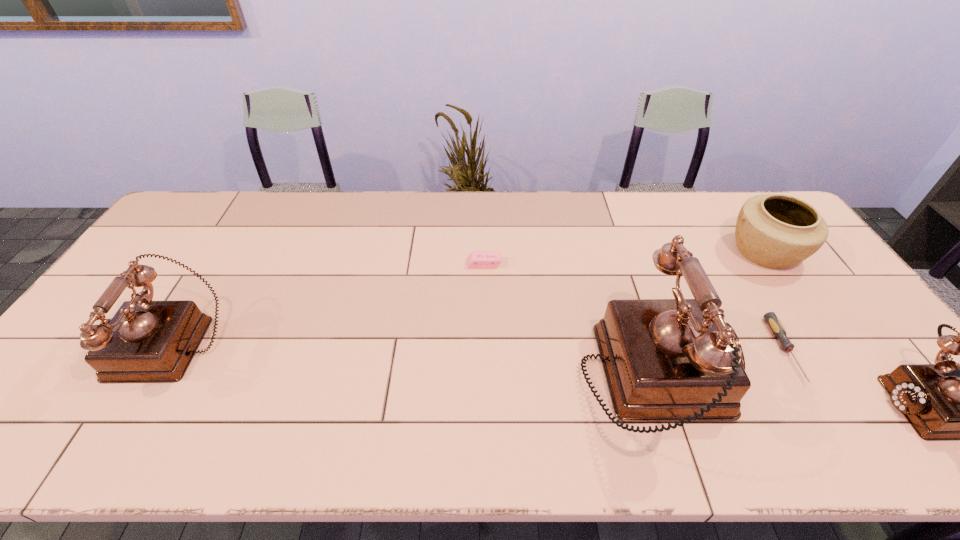
You are a GUI agent. You are given a task and a screenshot of the screen. Output one action in this format:
    pyautogui.click(x=<x>, y=<y>)
    Task: Click on the leftmost telephone
    
    Given the screenshot: What is the action you would take?
    pyautogui.click(x=146, y=341)

Where is `the fifth shortest object`? This screenshot has height=540, width=960. the fifth shortest object is located at coordinates (146, 341).

The width and height of the screenshot is (960, 540). What are the coordinates of `the tallest object` in the screenshot? It's located at (665, 360).

Find the location of a particular element. Image resolution: width=960 pixels, height=540 pixels. the fourth object from right to left is located at coordinates (665, 360).

At what (x,y) coordinates should I click in order to perform the action: click on pottery. Please return your answer as a coordinate pair (x, y). Looking at the image, I should click on (777, 231).

Where is `the fifth object from right to left`? the fifth object from right to left is located at coordinates (477, 259).

Locate an element on the screen. This screenshot has width=960, height=540. screwdriver is located at coordinates (771, 319).

Locate an element on the screen. This screenshot has height=540, width=960. vacant space located on the dial of the tallest object is located at coordinates (804, 379).

I want to click on free space located 0.060m on the left of the pottery, so click(709, 252).

I want to click on vacant space located on the right of the fifth object from right to left, so click(565, 264).